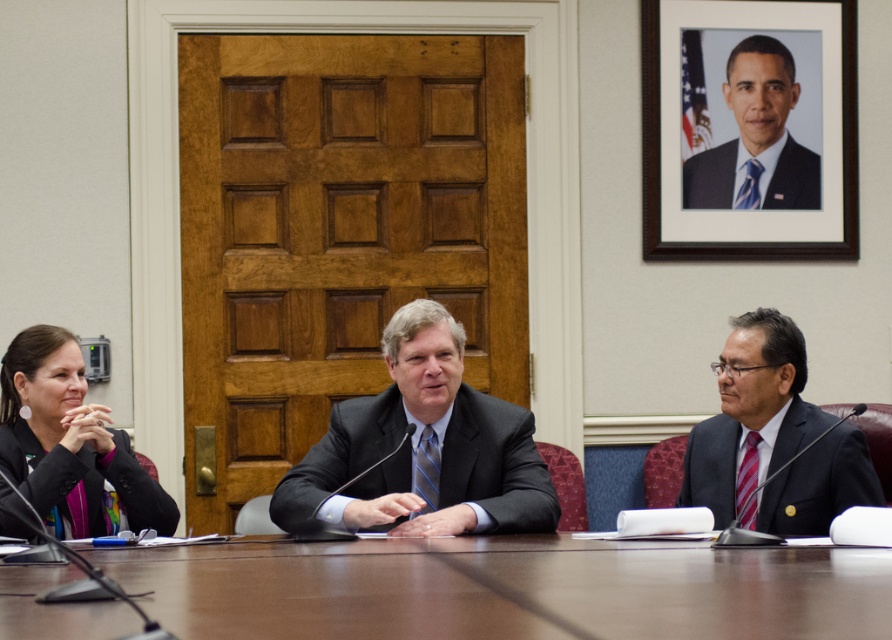
You are a person sitting at the brown wooden table at center. You need to pass a document to the matte black suit at right. Can you reach them without leaving your seat?

The distance between the brown wooden table at center and the matte black suit at right is 30.69 inches. Since the average arm reach while seated is about 24 to 30 inches, you might just barely reach them or need to stretch slightly.

You are a guest entering the conference room and need to sit at the brown wooden table at center. There is a black matte picture frame at upper right hanging above the table. Can you sit comfortably without the frame blocking your view?

The brown wooden table at center is not as tall as the black matte picture frame at upper right, so the frame is taller and likely positioned above the table. This means the frame would not block your view while sitting at the table.

Based on the scene description, which object is smaller in size between the brown wooden table at center and the matte black suit at center?

The brown wooden table at center is smaller in size compared to the matte black suit at center according to the description.